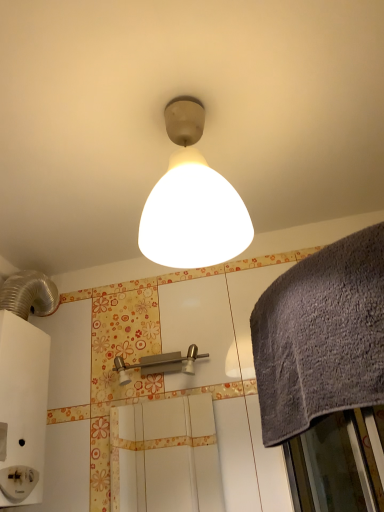
Question: Is point (259, 365) closer or farther from the camera than point (177, 359)?

Choices:
 (A) closer
 (B) farther

Answer: (A)

Question: Based on their sizes in the image, would you say gray textured towel at right is bigger or smaller than brushed metal shower at center?

Choices:
 (A) small
 (B) big

Answer: (B)

Question: Which is nearer to the gray textured towel at right?

Choices:
 (A) brushed metal shower at center
 (B) matte white lampshade at center
 (C) white matte screen door at center

Answer: (B)

Question: Estimate the real-world distances between objects in this image. Which object is farther from the gray textured towel at right?

Choices:
 (A) white matte screen door at center
 (B) brushed metal shower at center
 (C) matte white lampshade at center

Answer: (A)